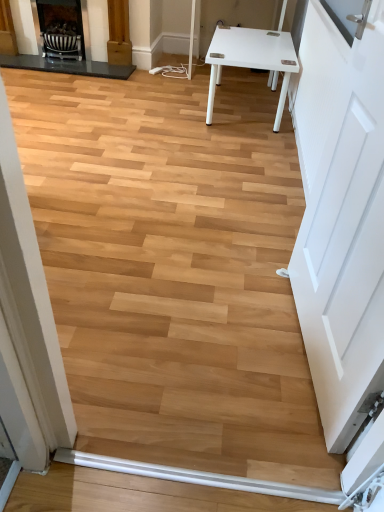
I want to click on vacant area to the left of white matte door at right, so click(x=201, y=335).